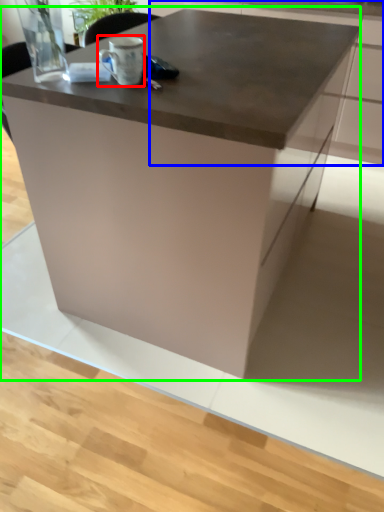
Question: Which object is the closest to the coffee cup (highlighted by a red box)? Choose among these: cabinetry (highlighted by a blue box) or table (highlighted by a green box).

Choices:
 (A) cabinetry
 (B) table

Answer: (B)